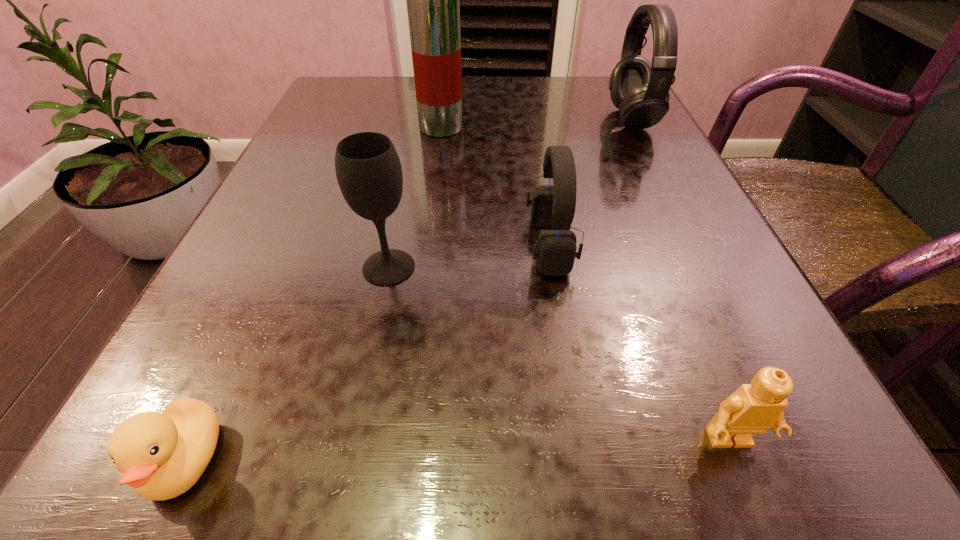
Find the location of a particular element. The image size is (960, 540). vacant space that is in between the third shortest object and the wineglass is located at coordinates (469, 256).

Locate an element on the screen. free space between the duckling and the taller headset is located at coordinates (408, 290).

The width and height of the screenshot is (960, 540). I want to click on empty space that is in between the leftmost object and the Lego, so click(457, 451).

Select which object appears as the third closest to the wineglass. Please provide its 2D coordinates. Your answer should be formatted as a tuple, i.e. [(x, y)], where the tuple contains the x and y coordinates of a point satisfying the conditions above.

[(433, 0)]

Identify the location of object that is the closest to the fourth tallest object. This screenshot has width=960, height=540. pyautogui.click(x=368, y=169).

What are the coordinates of `blank space that satisfies the following two spatial constraints: 1. on the earcups of the taller headset; 2. on the face of the Lego` in the screenshot? It's located at (794, 441).

The height and width of the screenshot is (540, 960). Find the location of `vacant space that satisfies the following two spatial constraints: 1. on the back side of the liquor; 2. on the right side of the wineglass`. vacant space that satisfies the following two spatial constraints: 1. on the back side of the liquor; 2. on the right side of the wineglass is located at coordinates (418, 127).